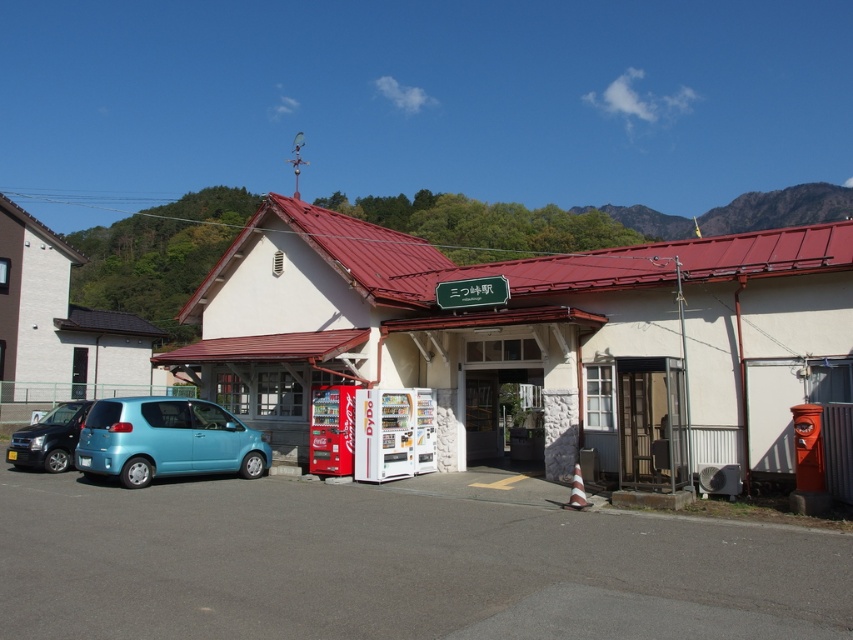
You are a delivery person needing to park your vehicle in front of the building. You see the light blue matte hatchback at lower left and the matte black suv at lower left. Which parking spot is closer to the entrance?

The light blue matte hatchback at lower left is positioned over the matte black suv at lower left, meaning it is closer to the entrance. Therefore, the parking spot occupied by the light blue matte hatchback at lower left is closer to the entrance.

You are a delivery person approaching the white matte building at center and the light blue matte hatchback at lower left. Which one should you reach first if you are coming from the direction of the road?

The white matte building at center is in front of the light blue matte hatchback at lower left, so you will reach the white matte building at center first.